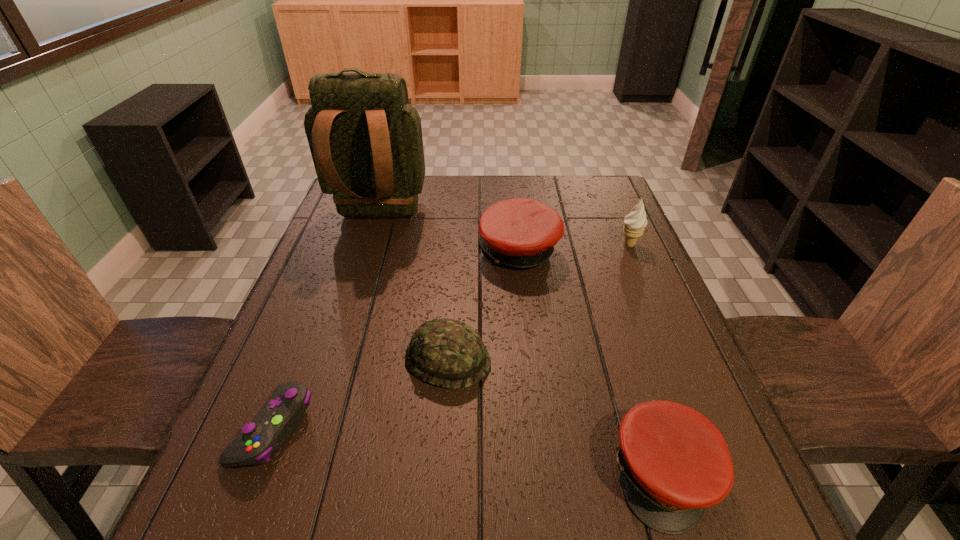
Identify which object is the third nearest to the second nearest cap. Please provide its 2D coordinates. Your answer should be formatted as a tuple, i.e. [(x, y)], where the tuple contains the x and y coordinates of a point satisfying the conditions above.

[(674, 462)]

Select which cap is the closest to the fifth shortest object. Please provide its 2D coordinates. Your answer should be formatted as a tuple, i.e. [(x, y)], where the tuple contains the x and y coordinates of a point satisfying the conditions above.

[(521, 233)]

Locate which cap ranks in proximity to the nearest cap. Please provide its 2D coordinates. Your answer should be formatted as a tuple, i.e. [(x, y)], where the tuple contains the x and y coordinates of a point satisfying the conditions above.

[(448, 353)]

The image size is (960, 540). In order to click on vacant space that satisfies the following two spatial constraints: 1. on the front-facing side of the farthest cap; 2. on the front side of the second nearest cap in this screenshot , I will do `click(531, 359)`.

You are a GUI agent. You are given a task and a screenshot of the screen. Output one action in this format:
    pyautogui.click(x=<x>, y=<y>)
    Task: Click on the vacant space that satisfies the following two spatial constraints: 1. on the front-facing side of the icecream; 2. on the front of the rightmost cap with an emblem
    
    Given the screenshot: What is the action you would take?
    pyautogui.click(x=727, y=474)